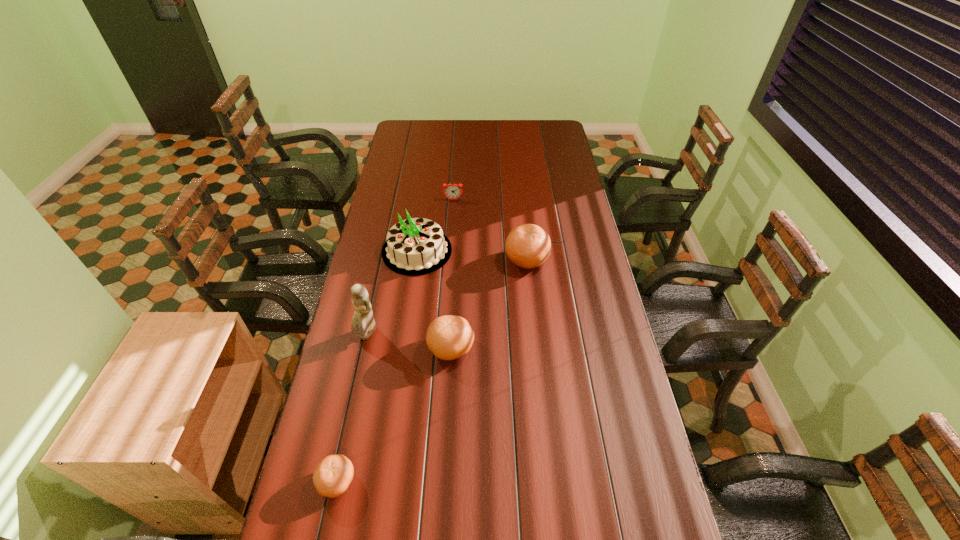
Identify the location of unoccupied area between the fifth shortest object and the tallest object. (392, 293).

This screenshot has width=960, height=540. In order to click on the closest object to the birthday cake in this screenshot , I will do `click(452, 191)`.

Find the location of `object identified as the fifth closest to the figurine`. object identified as the fifth closest to the figurine is located at coordinates (452, 191).

Image resolution: width=960 pixels, height=540 pixels. What are the coordinates of `clementine that is the third closest to the birthday cake` in the screenshot? It's located at (333, 475).

I want to click on clementine that is the closest to the figurine, so click(x=448, y=337).

This screenshot has height=540, width=960. Identify the location of vacant area that satisfies the following two spatial constraints: 1. on the back side of the third shortest object; 2. on the right side of the leftmost clementine. (366, 348).

At what (x,y) coordinates should I click in order to perform the action: click on free location that satisfies the following two spatial constraints: 1. on the front-facing side of the alarm clock; 2. on the left side of the rightmost clementine. Please return your answer as a coordinate pair (x, y). The image size is (960, 540). Looking at the image, I should click on (449, 260).

You are a GUI agent. You are given a task and a screenshot of the screen. Output one action in this format:
    pyautogui.click(x=<x>, y=<y>)
    Task: Click on the free space that satisfies the following two spatial constraints: 1. on the front-facing side of the tallest object; 2. on the right side of the second nearest clementine
    The height and width of the screenshot is (540, 960).
    Given the screenshot: What is the action you would take?
    pyautogui.click(x=364, y=348)

Where is `free spot that satisfies the following two spatial constraints: 1. on the front-facing side of the figurine; 2. on the right side of the leftmost clementine`? free spot that satisfies the following two spatial constraints: 1. on the front-facing side of the figurine; 2. on the right side of the leftmost clementine is located at coordinates (335, 482).